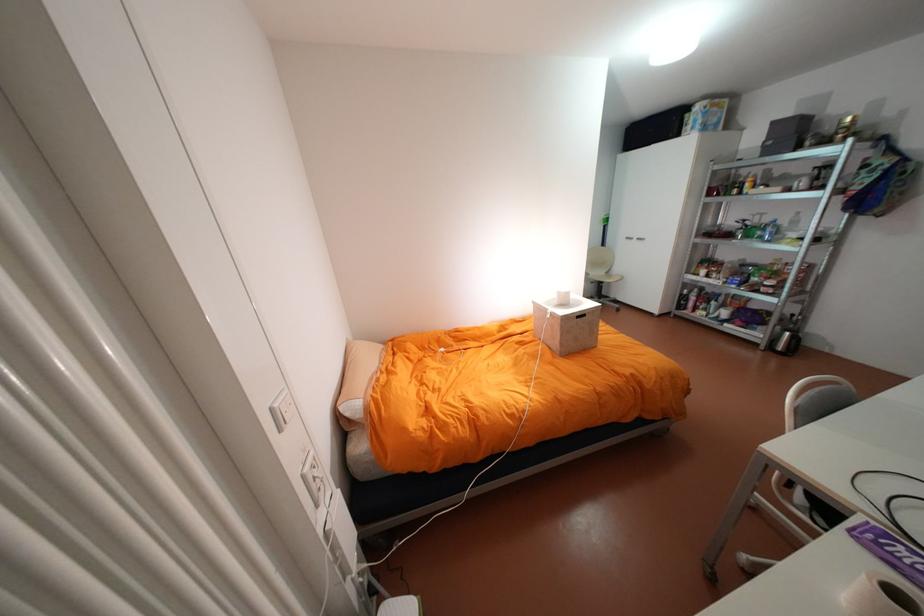
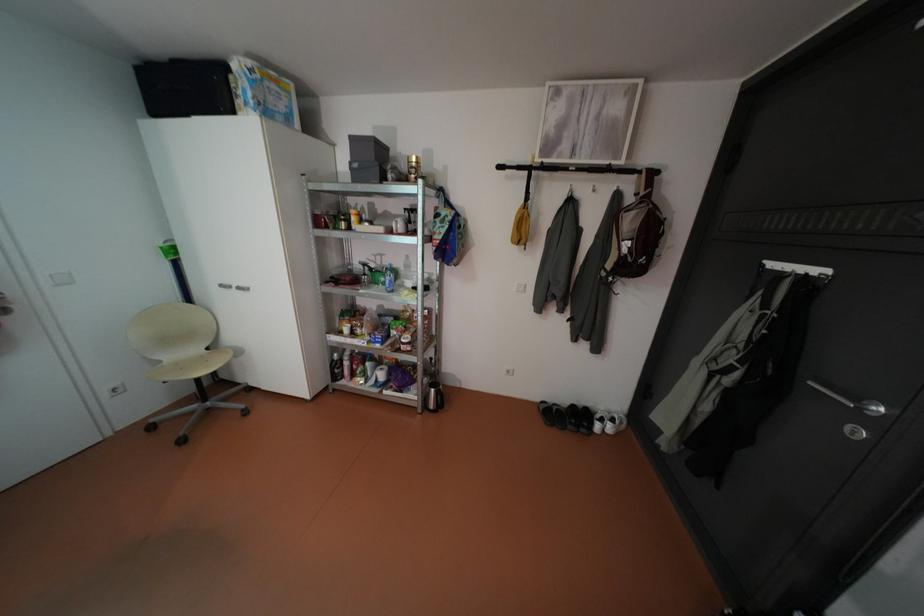
Where in the second image is the point corresponding to point (636, 128) from the first image?

(147, 69)